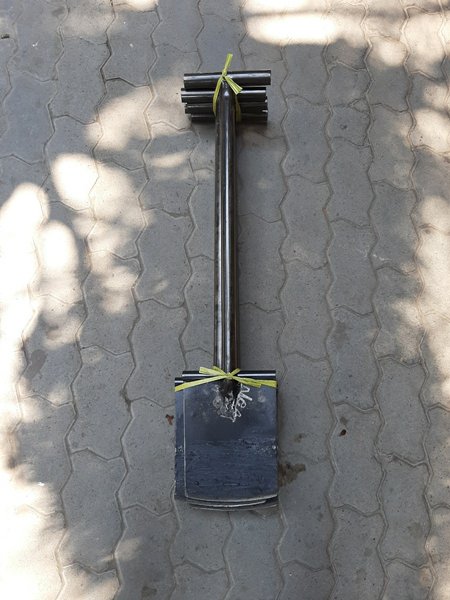
What are the coordinates of `black stain on brick` in the screenshot? It's located at (343, 433).